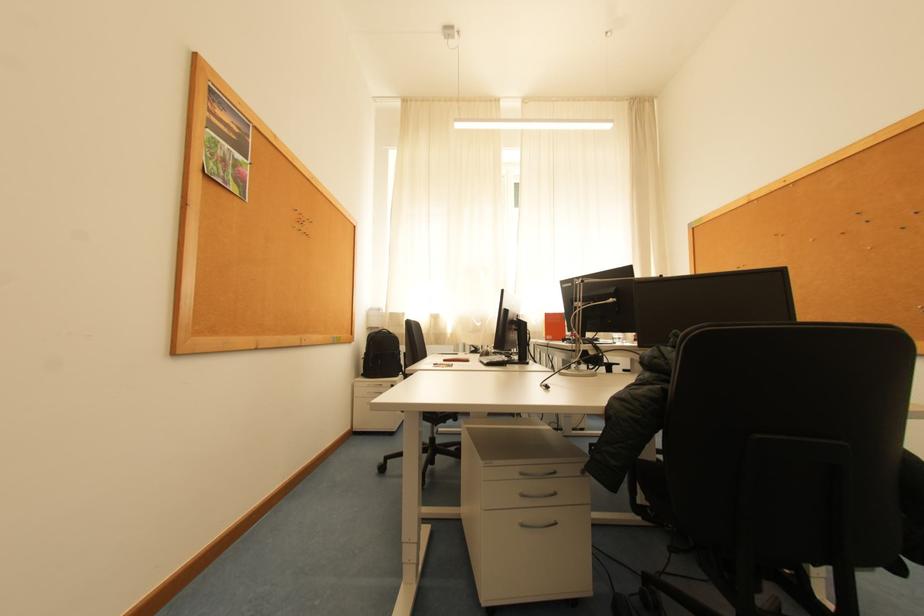
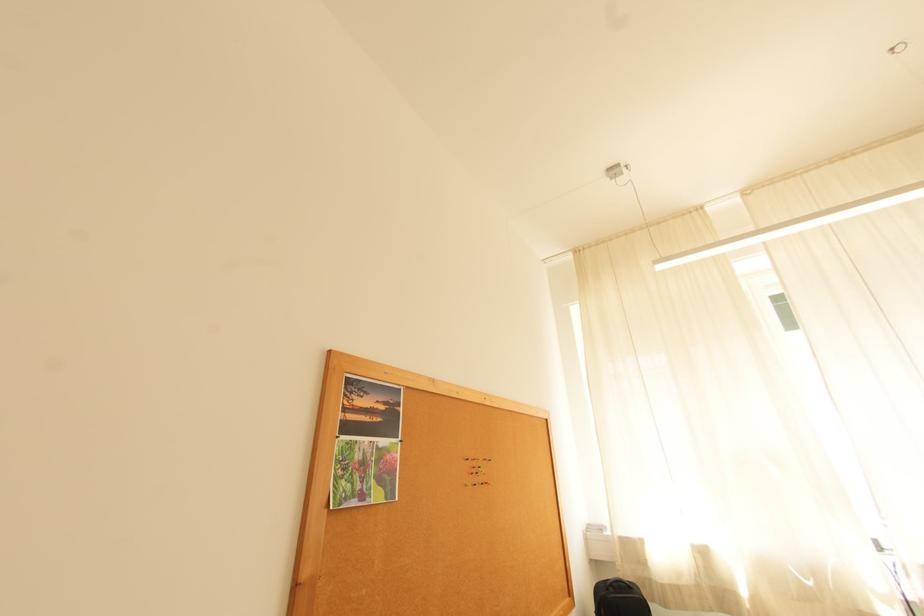
Based on the continuous images, in which direction is the camera rotating?

The camera's rotation is toward left-up.